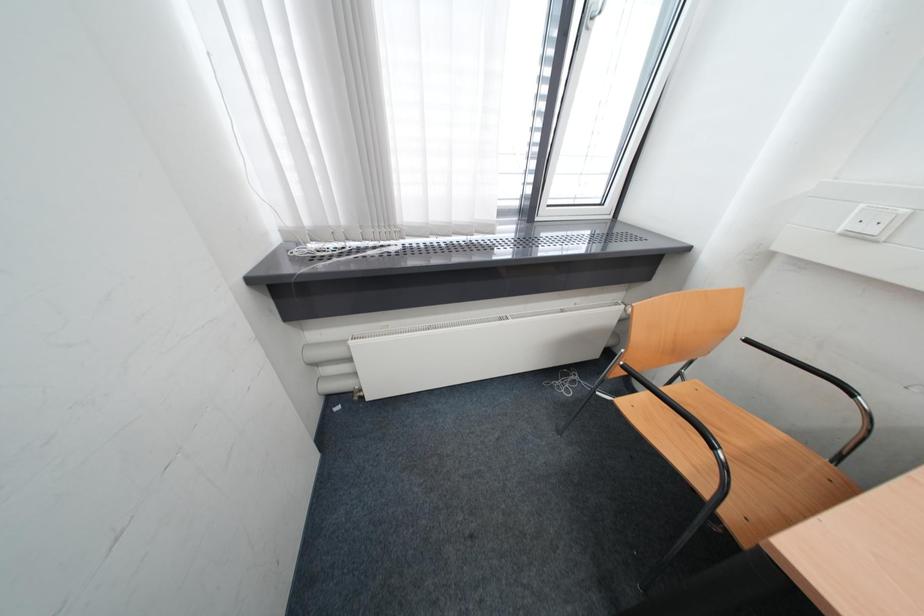
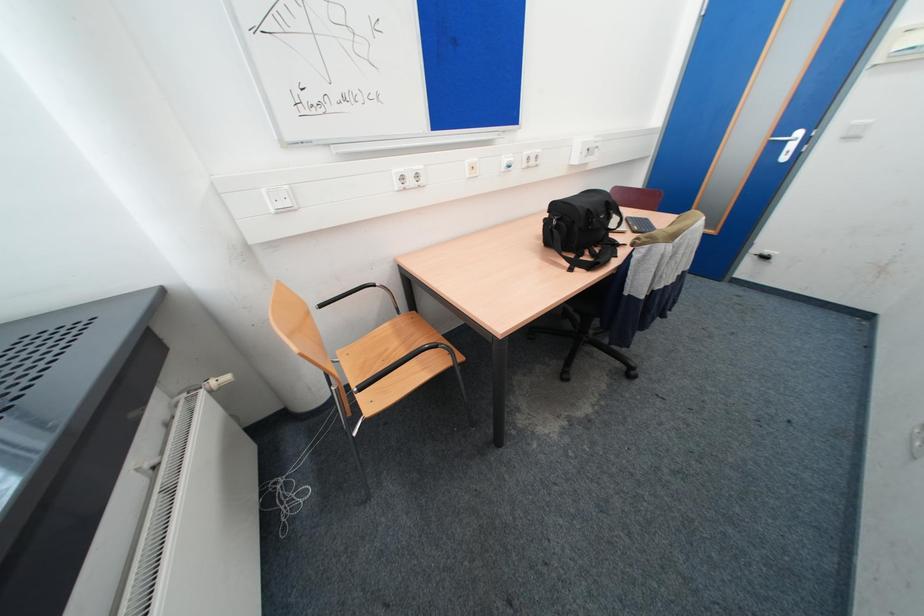
From the picture: First-person continuous shooting, in which direction is the camera rotating?

The camera rotated toward right-down.